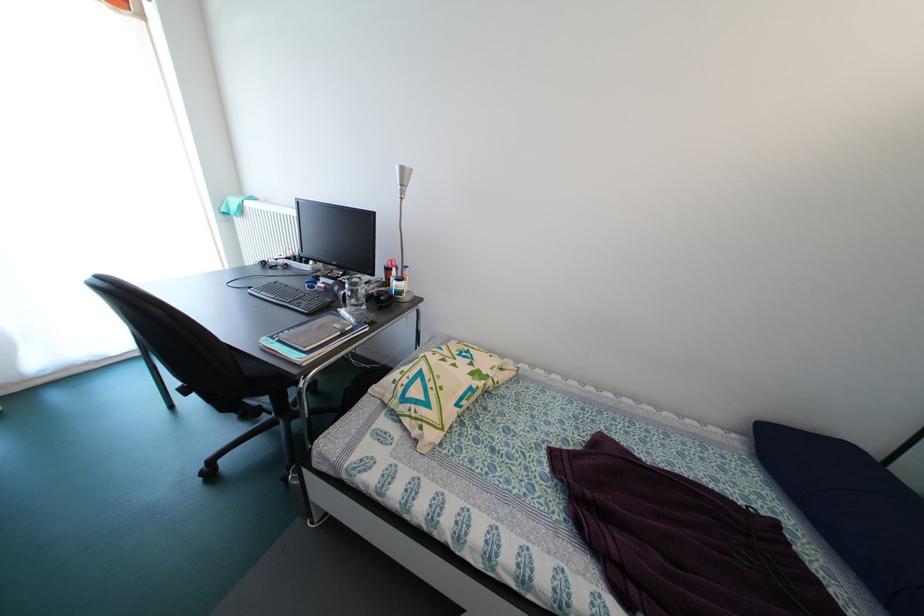
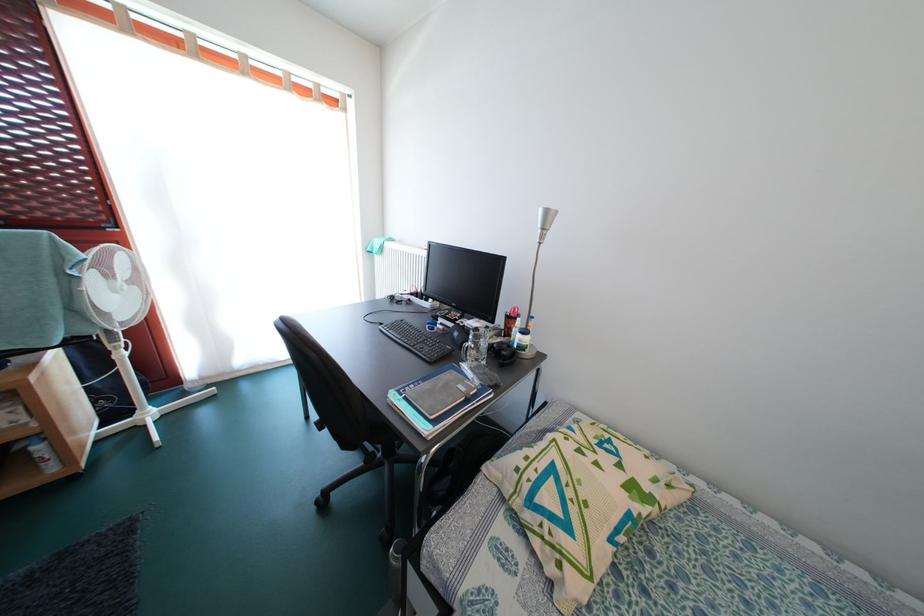
In a continuous first-person perspective shot, in which direction is the camera moving?

The cameraman walked toward left, forward.